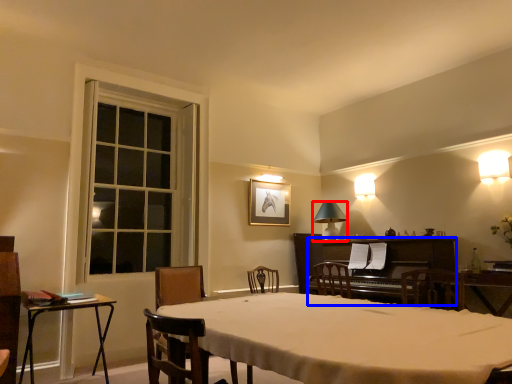
Question: Which of the following is the farthest to the observer, lamp (highlighted by a red box) or piano (highlighted by a blue box)?

Choices:
 (A) lamp
 (B) piano

Answer: (A)